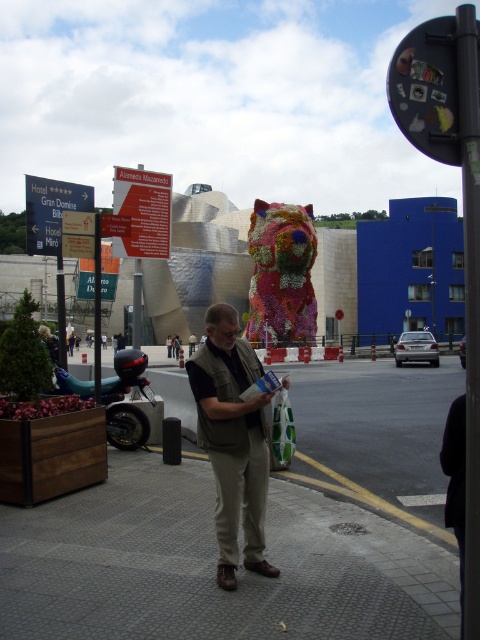
You are a tourist in the city holding a map and a shopping bag. You see the gray textured pavement at center and the fluffy fabric dog at center. Which object is located to the right of the other?

The gray textured pavement at center is positioned on the left side of fluffy fabric dog at center, so the fluffy fabric dog at center is to the right of the gray textured pavement at center.

You are a fashion designer observing the urban scene. You notice the khaki cotton vest at center and the fluffy fabric dog at center. Which item is positioned higher on the person?

The fluffy fabric dog at center is positioned higher than the khaki cotton vest at center, so the fluffy fabric dog at center is higher.

You are a tourist standing at the point marked by point (x=232, y=328) and want to go to the point marked by point (x=190, y=529). Which direction should you walk to reach your destination?

You should walk forward because point (x=190, y=529) is behind point (x=232, y=328), meaning it is in the direction you are facing.